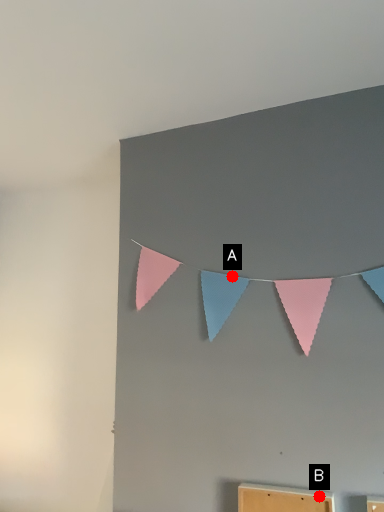
Question: Two points are circled on the image, labeled by A and B beside each circle. Which point appears farthest from the camera in this image?

Choices:
 (A) A is further
 (B) B is further

Answer: (A)